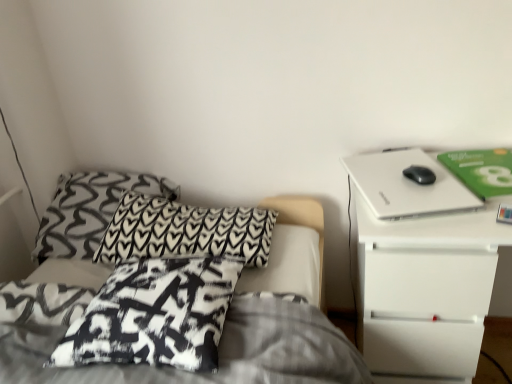
Question: From a real-world perspective, is black printed pillow at center, arranged as the 1th pillow when viewed from the front, physically located above or below black printed fabric pillow at upper left, which ranks as the second pillow in back-to-front order?

Choices:
 (A) below
 (B) above

Answer: (B)

Question: From the image's perspective, is black printed pillow at center, which appears as the 3th pillow when viewed from the back, located above or below black printed fabric pillow at upper left, acting as the 2th pillow starting from the front?

Choices:
 (A) below
 (B) above

Answer: (A)

Question: Which is farther from the white matte nightstand at right?

Choices:
 (A) green matte paperback book at upper right
 (B) black matte mouse at right
 (C) white matte laptop at upper right
 (D) black printed pillow at center, which appears as the 3th pillow when viewed from the back
 (E) black printed fabric pillow at upper left, acting as the 2th pillow starting from the front

Answer: (D)

Question: Based on their relative distances, which object is farther from the black printed pillow at center, which appears as the 3th pillow when viewed from the back?

Choices:
 (A) green matte paperback book at upper right
 (B) white matte laptop at upper right
 (C) black printed pillow at upper left, the 3th pillow in the front-to-back sequence
 (D) white matte nightstand at right
 (E) black matte mouse at right

Answer: (A)